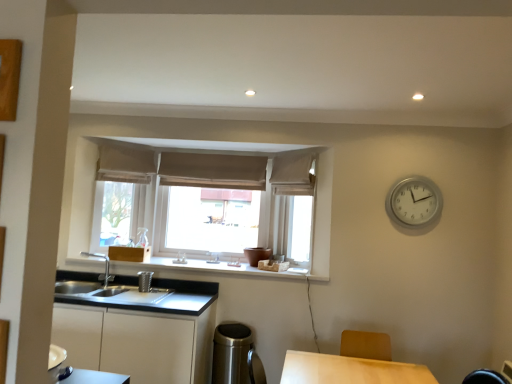
This screenshot has width=512, height=384. What do you see at coordinates (232, 354) in the screenshot? I see `polished stainless steel trash can at lower center` at bounding box center [232, 354].

The image size is (512, 384). What are the coordinates of `silver metallic clock at upper right` in the screenshot? It's located at (414, 201).

What do you see at coordinates (213, 171) in the screenshot?
I see `brown fabric curtain at center, acting as the second curtain starting from the left` at bounding box center [213, 171].

The height and width of the screenshot is (384, 512). In order to click on brown fabric curtain at center, acting as the second curtain starting from the left in this screenshot , I will do `click(213, 171)`.

Image resolution: width=512 pixels, height=384 pixels. What do you see at coordinates (125, 164) in the screenshot?
I see `beige fabric curtain at upper center, arranged as the third curtain when viewed from the right` at bounding box center [125, 164].

Identify the location of beige fabric curtain at upper center, arranged as the third curtain when viewed from the right. The image size is (512, 384). (125, 164).

Locate an element on the screen. white matte cabinet at lower left is located at coordinates (137, 342).

At what (x,y) coordinates should I click in order to perform the action: click on white fabric curtain at upper center, the first curtain viewed from the right. Please return your answer as a coordinate pair (x, y). The height and width of the screenshot is (384, 512). Looking at the image, I should click on (292, 175).

From a real-world perspective, does white matte cabinet at lower left stand above beige fabric curtain at upper center, the 1th curtain from the left?

Actually, white matte cabinet at lower left is physically below beige fabric curtain at upper center, the 1th curtain from the left, in the real world.

Is white matte cabinet at lower left taller than beige fabric curtain at upper center, arranged as the third curtain when viewed from the right?

Correct, white matte cabinet at lower left is much taller as beige fabric curtain at upper center, arranged as the third curtain when viewed from the right.

In terms of width, does white matte cabinet at lower left look wider or thinner when compared to beige fabric curtain at upper center, arranged as the third curtain when viewed from the right?

In the image, white matte cabinet at lower left appears to be wider than beige fabric curtain at upper center, arranged as the third curtain when viewed from the right.

Does white matte window sill at center lie in front of brown fabric curtain at center, marked as the 2th curtain in a right-to-left arrangement?

Yes, white matte window sill at center is closer to the camera.

Is white matte window sill at center facing away from brown fabric curtain at center, marked as the 2th curtain in a right-to-left arrangement?

No, brown fabric curtain at center, marked as the 2th curtain in a right-to-left arrangement, is not at the back of white matte window sill at center.

Between point (190, 267) and point (256, 172), which one is positioned behind?

Point (256, 172)

Between white matte window sill at center and brown fabric curtain at center, marked as the 2th curtain in a right-to-left arrangement, which one appears on the left side from the viewer's perspective?

white matte window sill at center is more to the left.

From the picture: Is polished stainless steel trash can at lower center not near silver metallic clock at upper right?

Yes, polished stainless steel trash can at lower center and silver metallic clock at upper right are quite far apart.

Considering the sizes of objects polished stainless steel trash can at lower center and silver metallic clock at upper right in the image provided, who is thinner, polished stainless steel trash can at lower center or silver metallic clock at upper right?

With smaller width is silver metallic clock at upper right.

Consider the image. How different are the orientations of polished stainless steel trash can at lower center and silver metallic clock at upper right in degrees?

3.16 degrees separate the facing orientations of polished stainless steel trash can at lower center and silver metallic clock at upper right.

Between point (244, 356) and point (430, 181), which one is positioned behind?

Point (430, 181)

Consider the image. Is brown fabric curtain at center, acting as the second curtain starting from the left, smaller than metallic stainless steel sink at lower left?

Correct, brown fabric curtain at center, acting as the second curtain starting from the left, occupies less space than metallic stainless steel sink at lower left.

Is brown fabric curtain at center, marked as the 2th curtain in a right-to-left arrangement, positioned before metallic stainless steel sink at lower left?

No, brown fabric curtain at center, marked as the 2th curtain in a right-to-left arrangement, is further to the viewer.

From a real-world perspective, who is located higher, brown fabric curtain at center, marked as the 2th curtain in a right-to-left arrangement, or metallic stainless steel sink at lower left?

brown fabric curtain at center, marked as the 2th curtain in a right-to-left arrangement, is physically above.

From a real-world perspective, which curtain is the 3rd one above the metallic stainless steel sink at lower left? Please provide its 2D coordinates.

[(213, 171)]

From a real-world perspective, is brown fabric curtain at center, acting as the second curtain starting from the left, over white matte cabinet at lower left?

Yes, from a real-world perspective, brown fabric curtain at center, acting as the second curtain starting from the left, is over white matte cabinet at lower left

This screenshot has height=384, width=512. Identify the location of the 2nd curtain above the white matte cabinet at lower left (from the image's perspective). (213, 171).

Does brown fabric curtain at center, marked as the 2th curtain in a right-to-left arrangement, have a lesser height compared to white matte cabinet at lower left?

Yes.

Is brown fabric curtain at center, acting as the second curtain starting from the left, with white matte cabinet at lower left?

No, brown fabric curtain at center, acting as the second curtain starting from the left, is not beside white matte cabinet at lower left.

Would you say silver metallic clock at upper right is outside white matte cabinet at lower left?

Yes, silver metallic clock at upper right is located beyond the bounds of white matte cabinet at lower left.

Considering the sizes of silver metallic clock at upper right and white matte cabinet at lower left in the image, is silver metallic clock at upper right wider or thinner than white matte cabinet at lower left?

In the image, silver metallic clock at upper right appears to be more narrow than white matte cabinet at lower left.

Which object is closer to the camera taking this photo, silver metallic clock at upper right or white matte cabinet at lower left?

white matte cabinet at lower left.

Does silver metallic clock at upper right have a greater height compared to white matte cabinet at lower left?

Incorrect, the height of silver metallic clock at upper right is not larger of that of white matte cabinet at lower left.

Is white matte window sill at center at the right side of metallic stainless steel sink at lower left?

Indeed, white matte window sill at center is positioned on the right side of metallic stainless steel sink at lower left.

Considering the positions of points (196, 265) and (79, 280), is point (196, 265) closer to camera compared to point (79, 280)?

No, it is not.

Can you confirm if white matte window sill at center is thinner than metallic stainless steel sink at lower left?

No.

How far apart are white matte window sill at center and metallic stainless steel sink at lower left?

A distance of 12.00 inches exists between white matte window sill at center and metallic stainless steel sink at lower left.

The height and width of the screenshot is (384, 512). In order to click on curtain located on the left of white matte cabinet at lower left in this screenshot , I will do `click(125, 164)`.

Identify the location of curtain that is the 1st object to the right of the white matte window sill at center, starting at the anchor. (213, 171).

Which object lies further to the anchor point metallic stainless steel sink at lower left, white matte cabinet at lower left or white fabric curtain at upper center, the first curtain viewed from the right?

Among the two, white fabric curtain at upper center, the first curtain viewed from the right, is located further to metallic stainless steel sink at lower left.

Which object lies nearer to the anchor point white matte cabinet at lower left, white fabric curtain at upper center, which appears as the 3th curtain when viewed from the left, or white matte window sill at center?

The object closer to white matte cabinet at lower left is white matte window sill at center.

Which object lies further to the anchor point brown fabric curtain at center, marked as the 2th curtain in a right-to-left arrangement, silver metallic clock at upper right or white fabric curtain at upper center, the first curtain viewed from the right?

silver metallic clock at upper right lies further to brown fabric curtain at center, marked as the 2th curtain in a right-to-left arrangement, than the other object.

Considering their positions, is white matte cabinet at lower left positioned closer to white fabric curtain at upper center, which appears as the 3th curtain when viewed from the left, than brown fabric curtain at center, marked as the 2th curtain in a right-to-left arrangement?

brown fabric curtain at center, marked as the 2th curtain in a right-to-left arrangement.

When comparing their distances from brown fabric curtain at center, acting as the second curtain starting from the left, does silver metallic clock at upper right or white matte window sill at center seem closer?

white matte window sill at center.

Estimate the real-world distances between objects in this image. Which object is further from brown fabric curtain at center, marked as the 2th curtain in a right-to-left arrangement, white fabric curtain at upper center, which appears as the 3th curtain when viewed from the left, or beige fabric curtain at upper center, the 1th curtain from the left?

The object further to brown fabric curtain at center, marked as the 2th curtain in a right-to-left arrangement, is white fabric curtain at upper center, which appears as the 3th curtain when viewed from the left.

Which object lies further to the anchor point metallic stainless steel sink at lower left, white matte cabinet at lower left or polished stainless steel trash can at lower center?

polished stainless steel trash can at lower center lies further to metallic stainless steel sink at lower left than the other object.

Estimate the real-world distances between objects in this image. Which object is further from brown fabric curtain at center, marked as the 2th curtain in a right-to-left arrangement, polished stainless steel trash can at lower center or metallic stainless steel sink at lower left?

polished stainless steel trash can at lower center is further to brown fabric curtain at center, marked as the 2th curtain in a right-to-left arrangement.

Where is `window sill between white matte cabinet at lower left and white fabric curtain at upper center, which appears as the 3th curtain when viewed from the left`? Image resolution: width=512 pixels, height=384 pixels. window sill between white matte cabinet at lower left and white fabric curtain at upper center, which appears as the 3th curtain when viewed from the left is located at coordinates (211, 268).

The image size is (512, 384). In order to click on countertop between beige fabric curtain at upper center, arranged as the third curtain when viewed from the right, and white matte cabinet at lower left in the up-down direction in this screenshot , I will do `click(148, 301)`.

Where is `window sill between beige fabric curtain at upper center, the 1th curtain from the left, and metallic stainless steel sink at lower left vertically`? Image resolution: width=512 pixels, height=384 pixels. window sill between beige fabric curtain at upper center, the 1th curtain from the left, and metallic stainless steel sink at lower left vertically is located at coordinates (211, 268).

Where is `window sill between metallic stainless steel sink at lower left and polished stainless steel trash can at lower center from left to right`? The height and width of the screenshot is (384, 512). window sill between metallic stainless steel sink at lower left and polished stainless steel trash can at lower center from left to right is located at coordinates [x=211, y=268].